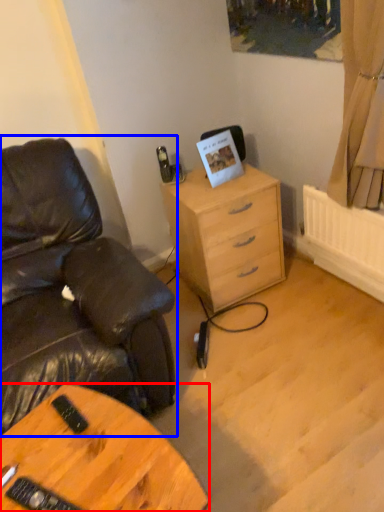
Question: Which of the following is the closest to the observer, desk (highlighted by a red box) or chair (highlighted by a blue box)?

Choices:
 (A) desk
 (B) chair

Answer: (A)